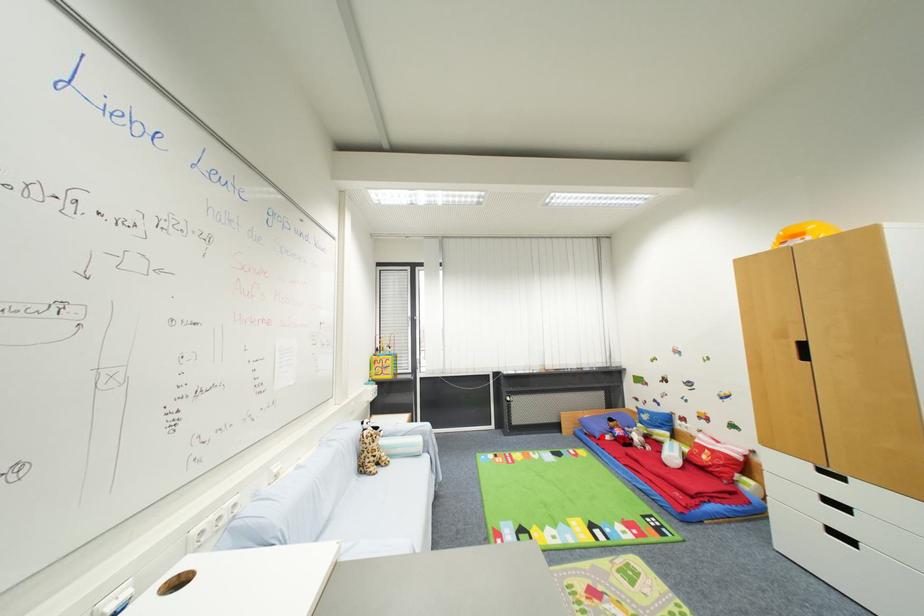
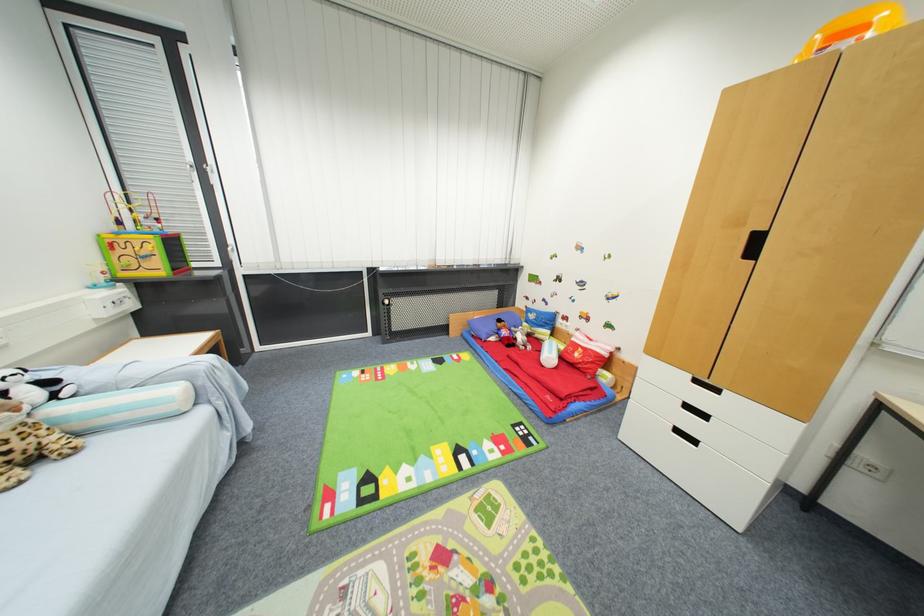
The point at the highlighted location is marked in the first image. Where is the corresponding point in the second image?

(488, 339)